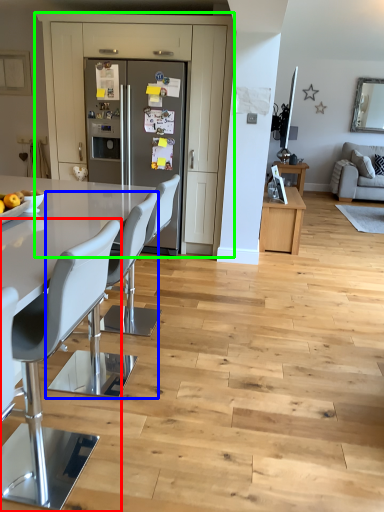
Question: Which object is positioned farthest from chair (highlighted by a red box)? Select from chair (highlighted by a blue box) and cabinetry (highlighted by a green box).

Choices:
 (A) chair
 (B) cabinetry

Answer: (B)